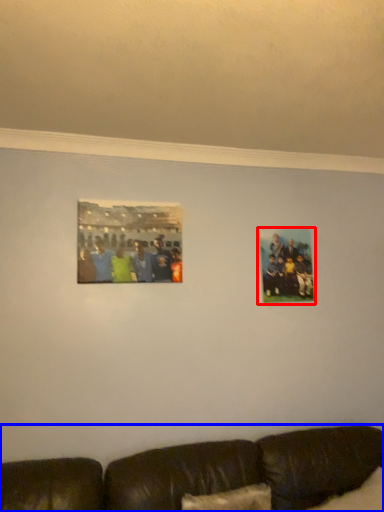
Question: Which point is closer to the camera, picture frame (highlighted by a red box) or studio couch (highlighted by a blue box)?

Choices:
 (A) picture frame
 (B) studio couch

Answer: (B)